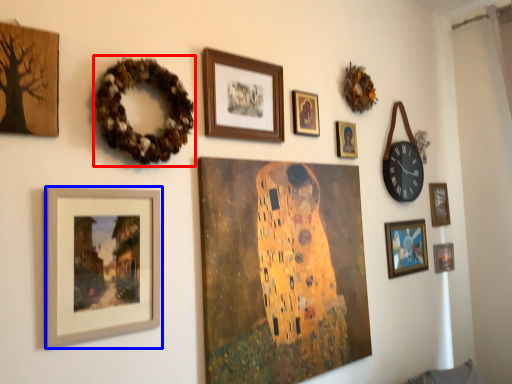
Question: Which object appears farthest to the camera in this image, decor (highlighted by a red box) or picture frame (highlighted by a blue box)?

Choices:
 (A) decor
 (B) picture frame

Answer: (A)